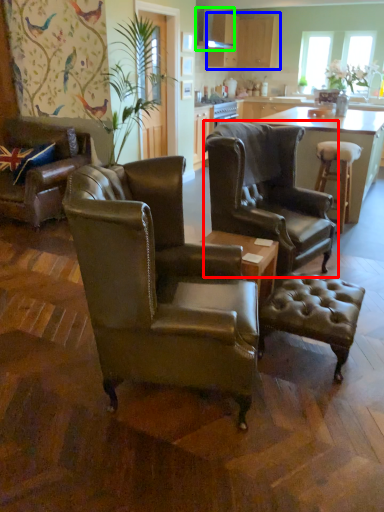
Question: Estimate the real-world distances between objects in this image. Which object is closer to chair (highlighted by a red box), cabinetry (highlighted by a blue box) or exhaust hood (highlighted by a green box)?

Choices:
 (A) cabinetry
 (B) exhaust hood

Answer: (B)